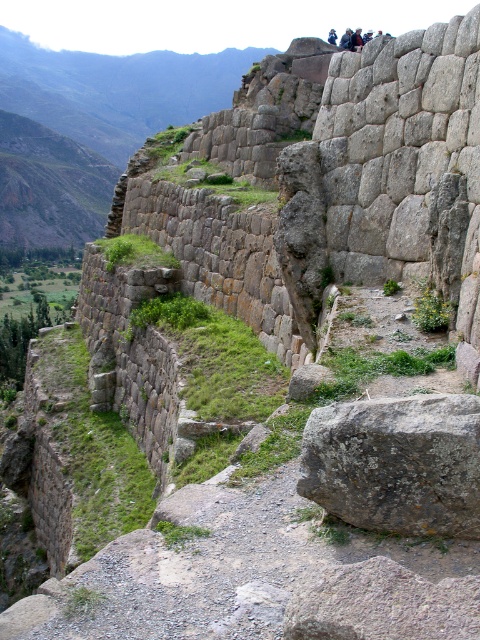
Question: Does dark blue fabric at upper center lie in front of dark hair person at upper center?

Choices:
 (A) yes
 (B) no

Answer: (A)

Question: Among these points, which one is farthest from the camera?

Choices:
 (A) (359, 29)
 (B) (334, 35)
 (C) (441, 524)

Answer: (A)

Question: Which object is closer to the camera taking this photo?

Choices:
 (A) dark brown leather jacket at upper center
 (B) gray rough rock at center

Answer: (B)

Question: Can you confirm if gray rough rock at center is thinner than dark hair person at upper center?

Choices:
 (A) no
 (B) yes

Answer: (B)

Question: Which of the following is the closest to the observer?

Choices:
 (A) gray rough rock at center
 (B) dark hair person at upper center
 (C) dark brown leather jacket at upper center

Answer: (A)

Question: Does gray rough rock at center appear under dark brown leather jacket at upper center?

Choices:
 (A) yes
 (B) no

Answer: (A)